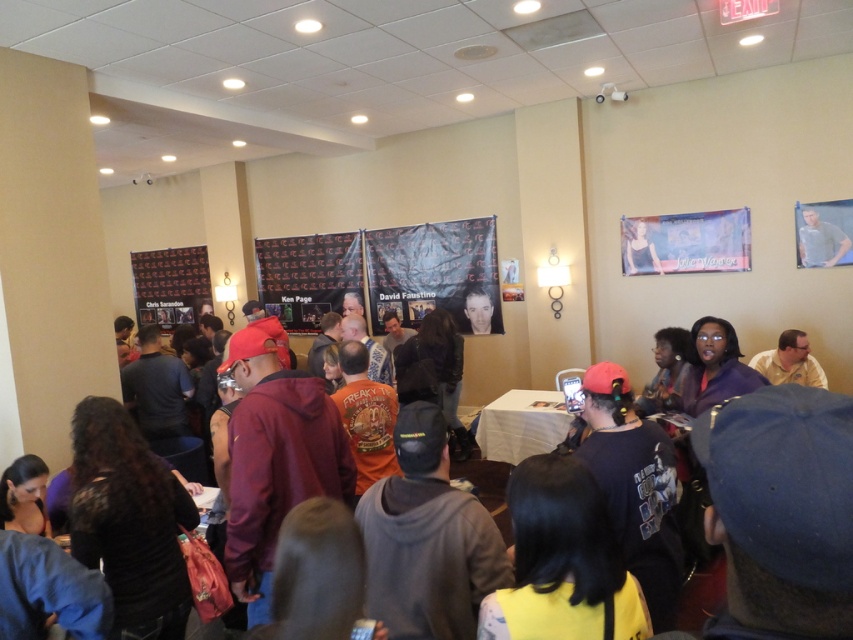
Question: Which object is farther from the camera taking this photo?

Choices:
 (A) dark red hoodie at center
 (B) white cloth-covered table at center

Answer: (B)

Question: Does dark red hoodie at center have a greater width compared to white cloth-covered table at center?

Choices:
 (A) no
 (B) yes

Answer: (A)

Question: Does dark red hoodie at center have a lesser width compared to white cloth-covered table at center?

Choices:
 (A) yes
 (B) no

Answer: (A)

Question: Is dark red hoodie at center to the right of white cloth-covered table at center from the viewer's perspective?

Choices:
 (A) no
 (B) yes

Answer: (A)

Question: Which point is closer to the camera?

Choices:
 (A) (782, 595)
 (B) (520, 428)

Answer: (A)